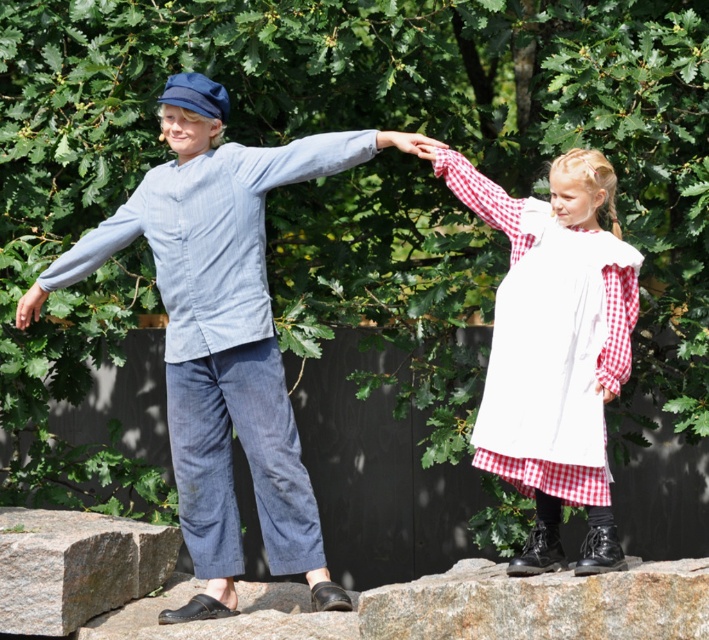
Question: Among these points, which one is farthest from the camera?

Choices:
 (A) (22, 320)
 (B) (463, 625)

Answer: (A)

Question: Can you confirm if denim pants at center is thinner than granite boulder at lower center?

Choices:
 (A) no
 (B) yes

Answer: (A)

Question: Among these points, which one is nearest to the camera?

Choices:
 (A) (22, 554)
 (B) (179, 442)
 (C) (347, 147)

Answer: (C)

Question: Does light blue denim pants at left appear over matte blue jeans at left?

Choices:
 (A) yes
 (B) no

Answer: (A)

Question: Can you confirm if denim shirt sleeve at upper center is wider than matte blue jeans at left?

Choices:
 (A) no
 (B) yes

Answer: (B)

Question: Estimate the real-world distances between objects in this image. Which object is farther from the denim pants at center?

Choices:
 (A) light blue denim pants at left
 (B) granite boulder at lower center
 (C) white cotton sleeve at upper center

Answer: (B)